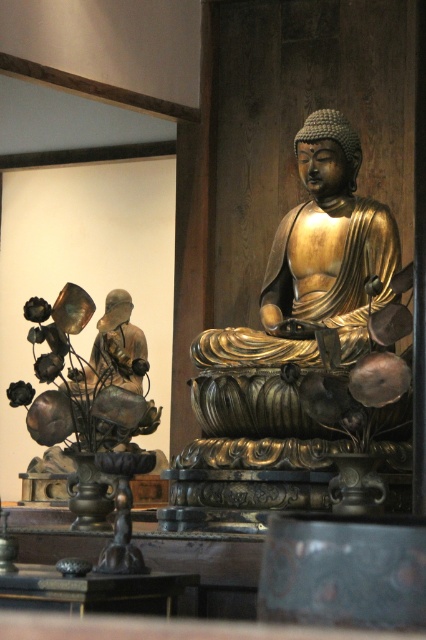
Can you confirm if matte black statue at left is positioned above black polished wood table at center?

Indeed, matte black statue at left is positioned over black polished wood table at center.

Identify the location of matte black statue at left. (88, 396).

I want to click on matte black statue at left, so (88, 396).

Is gold polished bronze buddha at center taller than black polished wood table at center?

Indeed, gold polished bronze buddha at center has a greater height compared to black polished wood table at center.

Can you confirm if gold polished bronze buddha at center is bigger than black polished wood table at center?

Yes, gold polished bronze buddha at center is bigger than black polished wood table at center.

Does point (207, 500) lie in front of point (11, 580)?

No, it is behind (11, 580).

At what (x,y) coordinates should I click in order to perform the action: click on gold polished bronze buddha at center. Please return your answer as a coordinate pair (x, y). Looking at the image, I should click on (305, 362).

Does gold polished bronze buddha at center have a lesser width compared to matte black statue at left?

Correct, gold polished bronze buddha at center's width is less than matte black statue at left's.

Which is more to the right, gold polished bronze buddha at center or matte black statue at left?

gold polished bronze buddha at center

Between point (313, 412) and point (101, 445), which one is positioned behind?

Positioned behind is point (101, 445).

Locate an element on the screen. gold polished bronze buddha at center is located at coordinates click(x=305, y=362).